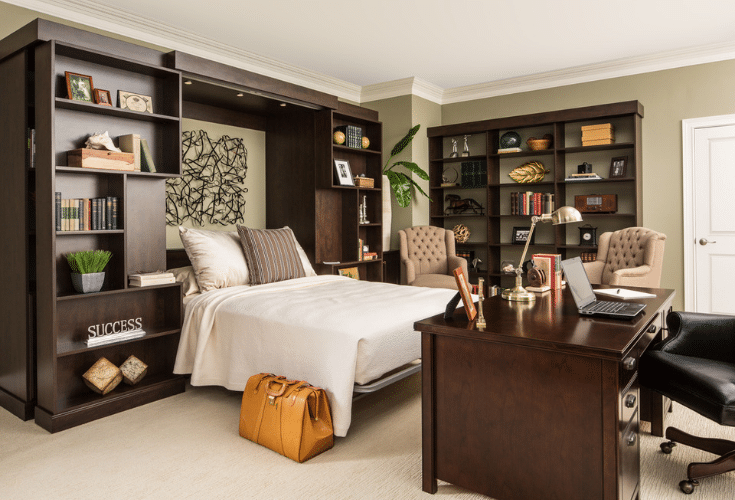
I want to click on white bed and cover, so click(315, 344).